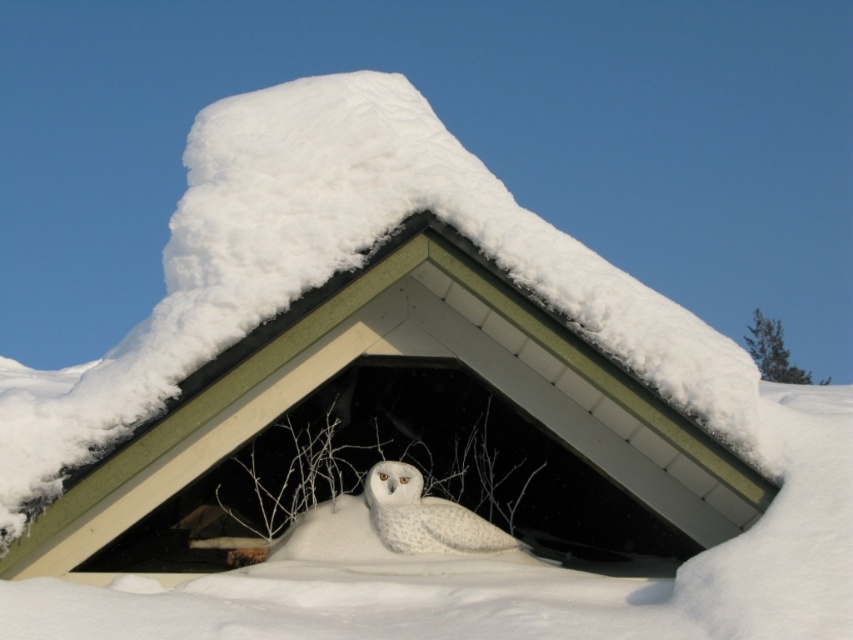
Where is `white matte owl at center`? The height and width of the screenshot is (640, 853). white matte owl at center is located at coordinates (374, 365).

Identify the location of white matte owl at center. (374, 365).

I want to click on white matte owl at center, so click(x=374, y=365).